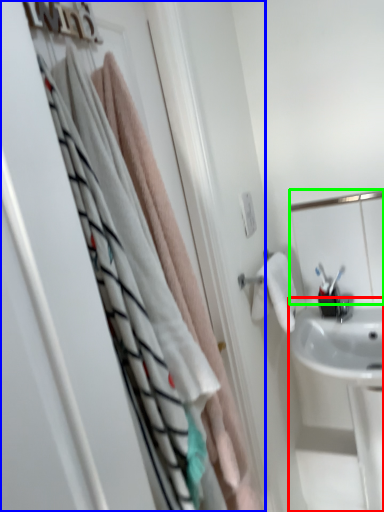
Question: Based on their relative distances, which object is farther from sink (highlighted by a red box)? Choose from closet (highlighted by a blue box) and mirror (highlighted by a green box).

Choices:
 (A) closet
 (B) mirror

Answer: (A)